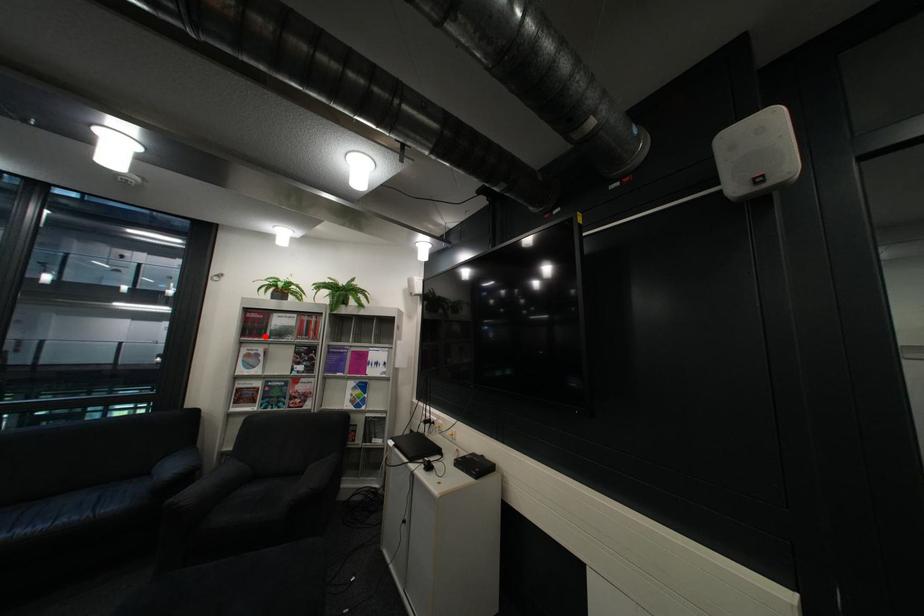
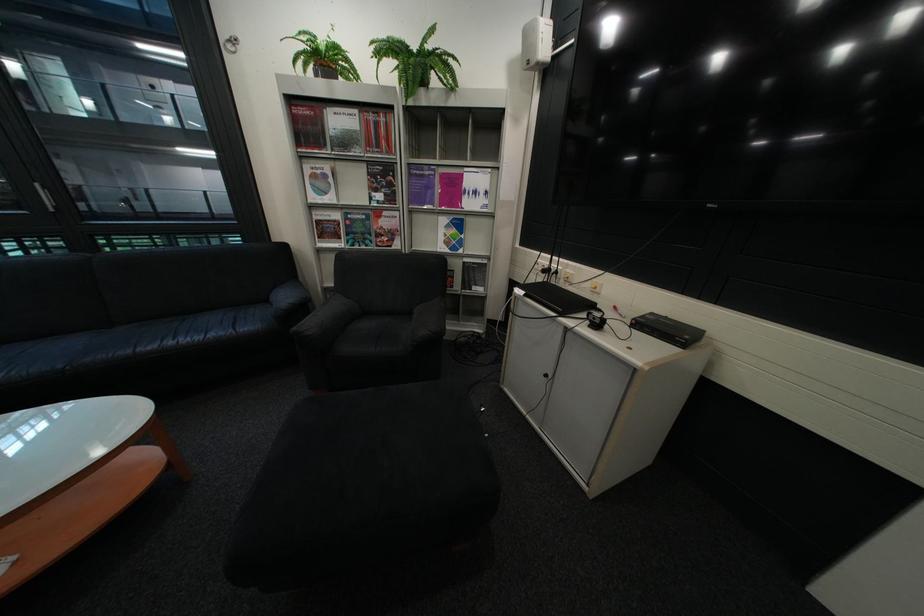
Find the pixel in the second image that matches the highlighted location in the first image.

(322, 147)